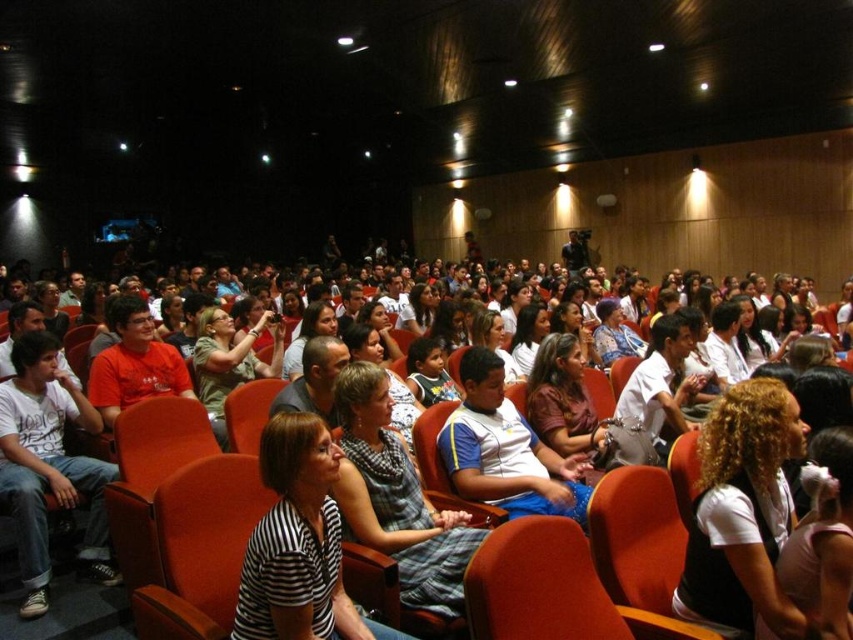
You are sitting at point A which is at point (229, 320) and want to walk to the stage. There is an obstacle at point B at point (596, 305). Can you walk around the obstacle to reach the stage?

Point (229, 320) is in front of point (596, 305), so you can walk around the obstacle at point B to reach the stage.

You are standing at the back of the theater and see a person wearing a white cotton shirt at left. If you want to throw a small note to them, will you be able to reach them without leaving your seat?

The distance between you and the white cotton shirt at left is 2.97 meters. Since the average throwing distance from a seated position is around 3 meters, you might barely reach them but there is a risk of missing.

Consider the image. You are an event planner standing at the back of the theater. You need to ensure that everyone can see the stage. The white cotton shirt at left and the striped fabric dress at center are in the same row. Which person might be blocking the view of the other?

The white cotton shirt at left is much taller than the striped fabric dress at center, so the person in the white cotton shirt at left might be blocking the view of the striped fabric dress at center.